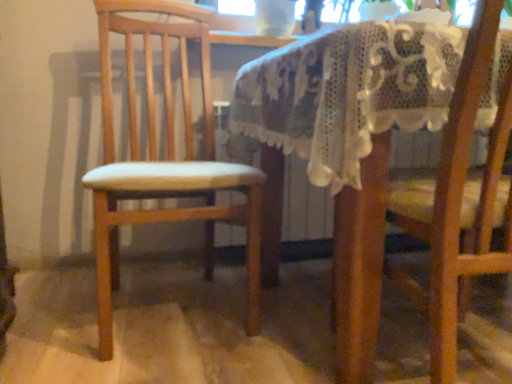
Question: From their relative heights in the image, would you say wooden chair at left, arranged as the 2th chair when viewed from the right, is taller or shorter than wooden chair at right, which appears as the 2th chair when viewed from the left?

Choices:
 (A) short
 (B) tall

Answer: (B)

Question: In terms of width, does wooden chair at left, arranged as the 2th chair when viewed from the right, look wider or thinner when compared to wooden chair at right, which appears as the 2th chair when viewed from the left?

Choices:
 (A) thin
 (B) wide

Answer: (B)

Question: Does point (151, 170) appear closer or farther from the camera than point (508, 39)?

Choices:
 (A) farther
 (B) closer

Answer: (A)

Question: Is wooden chair at right, which appears as the 2th chair when viewed from the left, wider or thinner than wooden chair at left, the 1th chair from the left?

Choices:
 (A) thin
 (B) wide

Answer: (A)

Question: From the image's perspective, is wooden chair at right, which appears as the 2th chair when viewed from the left, above or below wooden chair at left, the 1th chair from the left?

Choices:
 (A) below
 (B) above

Answer: (A)

Question: Relative to wooden chair at left, the 1th chair from the left, is wooden chair at right, the 1th chair viewed from the right, in front or behind?

Choices:
 (A) front
 (B) behind

Answer: (A)

Question: Considering the relative positions of wooden chair at right, which appears as the 2th chair when viewed from the left, and wooden chair at left, the 1th chair from the left, in the image provided, is wooden chair at right, which appears as the 2th chair when viewed from the left, to the left or to the right of wooden chair at left, the 1th chair from the left,?

Choices:
 (A) right
 (B) left

Answer: (A)